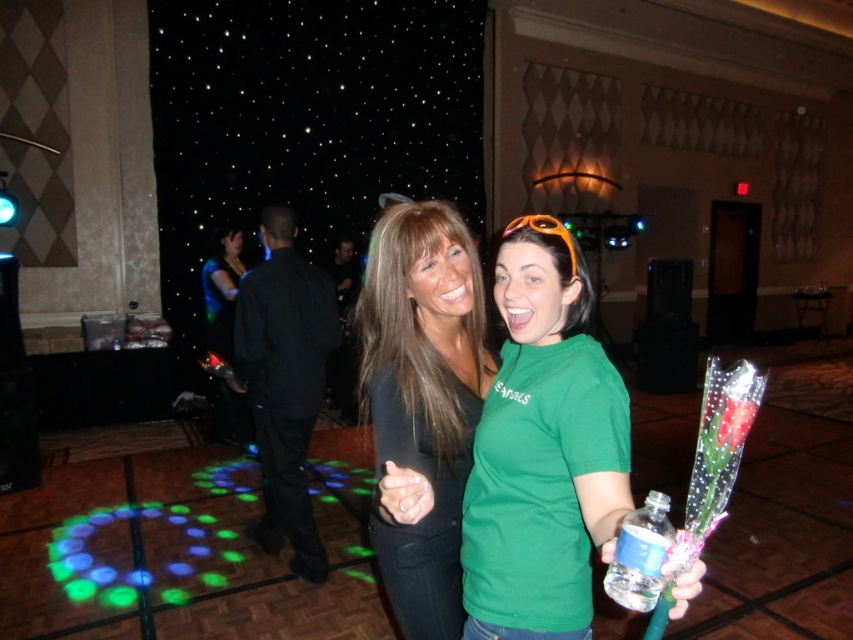
Consider the image. Is the position of green matte shirt at center less distant than that of matte black top at center?

That is True.

Does green matte shirt at center appear under matte black top at center?

Indeed, green matte shirt at center is positioned under matte black top at center.

Is point (537, 364) closer to viewer compared to point (440, 444)?

Yes, point (537, 364) is closer to viewer.

Where is `green matte shirt at center`? This screenshot has height=640, width=853. green matte shirt at center is located at coordinates (543, 449).

In the scene shown: Does matte black top at center appear under clear plastic bottle at lower right?

No.

Between point (451, 620) and point (647, 540), which one is positioned behind?

Point (451, 620)

Is point (433, 324) more distant than point (646, 522)?

Yes.

Locate an element on the screen. This screenshot has width=853, height=640. matte black top at center is located at coordinates (422, 404).

Who is positioned more to the left, green matte shirt at center or clear plastic bottle at lower right?

green matte shirt at center is more to the left.

Is point (479, 609) behind point (662, 525)?

Yes.

Is point (572, 333) more distant than point (643, 582)?

Yes.

Find the location of a particular element. This screenshot has width=853, height=640. green matte shirt at center is located at coordinates (543, 449).